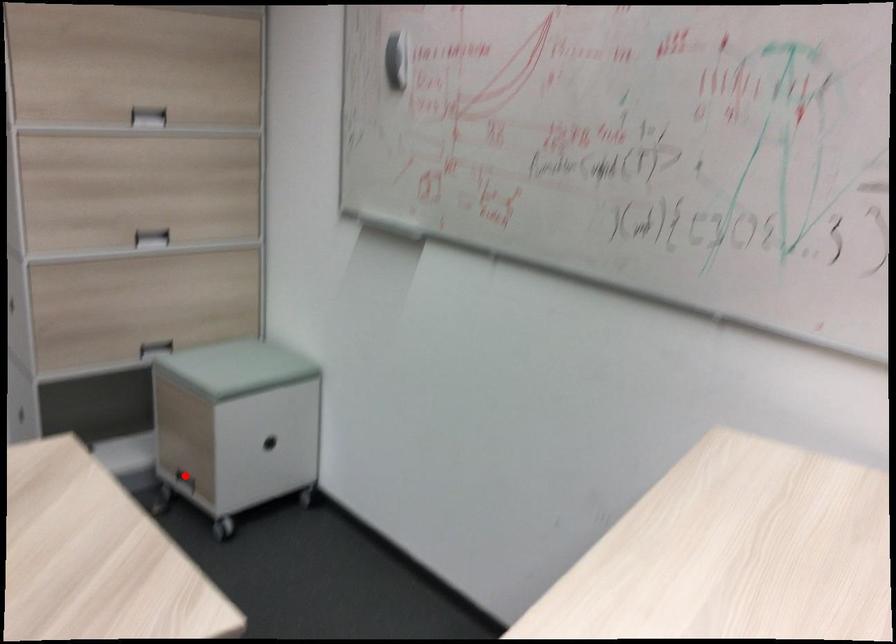
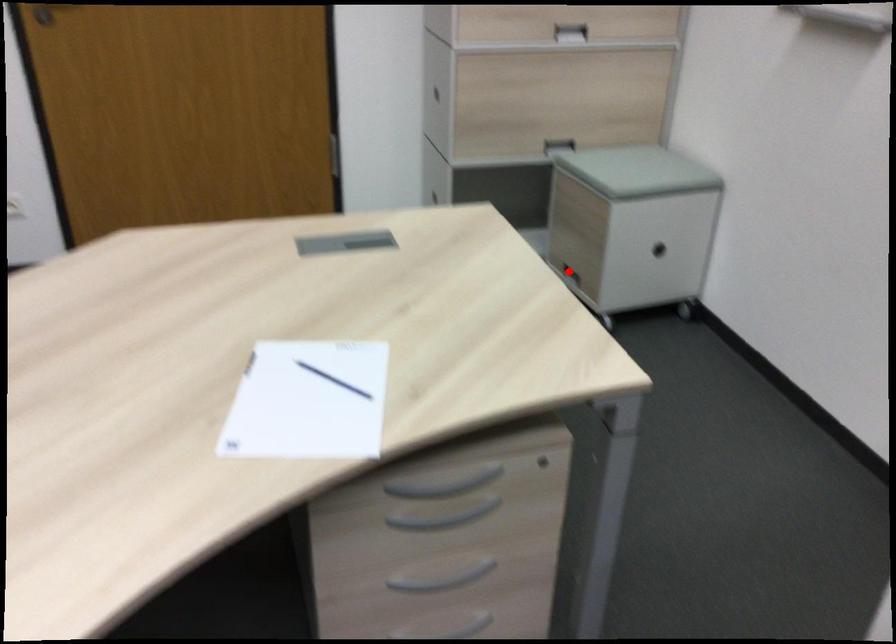
I am providing you with two images of the same scene from different viewpoints. A red point is marked on the first image and another point is marked on the second image. Is the marked point in image1 the same physical position as the marked point in image2?

Yes